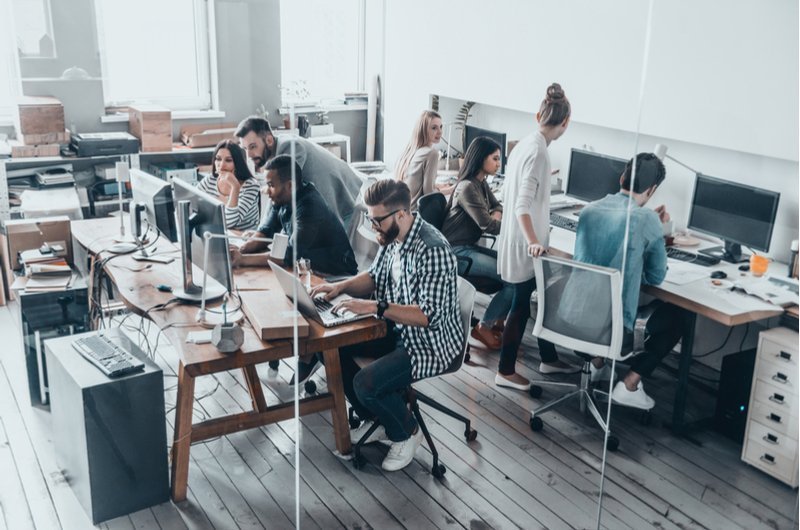
You are a GUI agent. You are given a task and a screenshot of the screen. Output one action in this format:
    pyautogui.click(x=<x>, y=<y>)
    Task: Click on the cables
    The width and height of the screenshot is (800, 530).
    Given the screenshot: What is the action you would take?
    pyautogui.click(x=206, y=391), pyautogui.click(x=158, y=339), pyautogui.click(x=146, y=333), pyautogui.click(x=138, y=322), pyautogui.click(x=125, y=319), pyautogui.click(x=100, y=308), pyautogui.click(x=90, y=303), pyautogui.click(x=150, y=242), pyautogui.click(x=144, y=237)